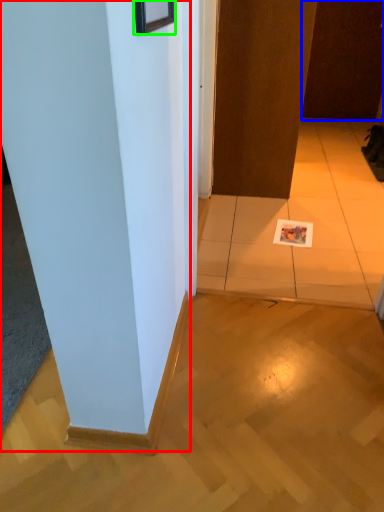
Question: Which is nearer to the pillar (highlighted by a red box)? door (highlighted by a blue box) or picture frame (highlighted by a green box).

Choices:
 (A) door
 (B) picture frame

Answer: (B)